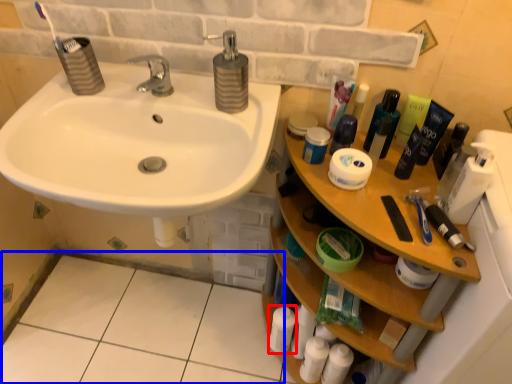
Question: Which of the following is the farthest to the observer, toiletry (highlighted by a red box) or tile (highlighted by a blue box)?

Choices:
 (A) toiletry
 (B) tile

Answer: (A)